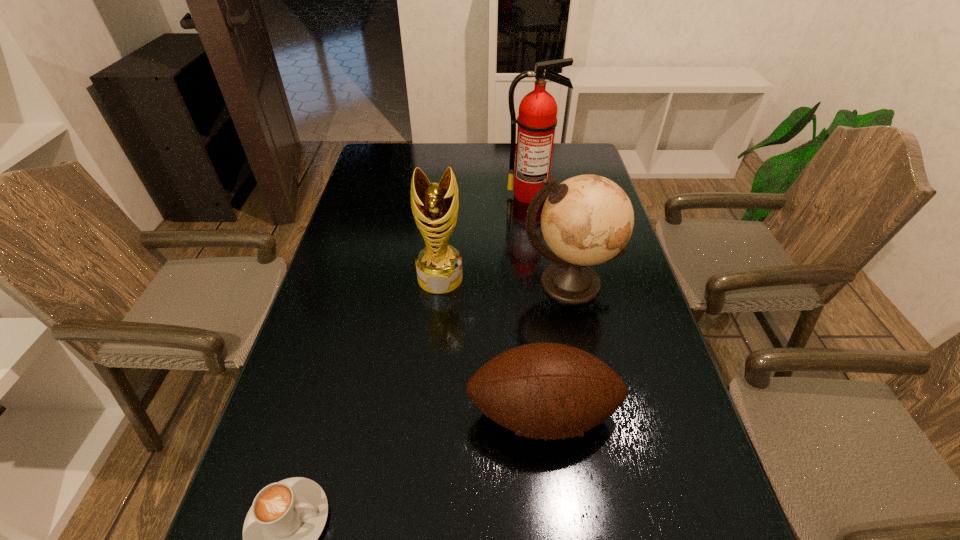
Where is `the farthest object`? The image size is (960, 540). the farthest object is located at coordinates (537, 119).

What are the coordinates of `fire extinguisher` in the screenshot? It's located at (537, 119).

Identify the location of award. This screenshot has width=960, height=540. 435,206.

The width and height of the screenshot is (960, 540). In order to click on globe in this screenshot , I will do `click(587, 220)`.

Identify the location of the second nearest object. (545, 391).

This screenshot has height=540, width=960. Identify the location of football. (545, 391).

Where is `free space located on the side of the fire extinguisher near the handle`? The width and height of the screenshot is (960, 540). free space located on the side of the fire extinguisher near the handle is located at coordinates (541, 264).

This screenshot has height=540, width=960. I want to click on vacant space located 0.400m on the front-facing side of the fourth object from right to left, so click(425, 439).

The width and height of the screenshot is (960, 540). I want to click on free space located on the front-facing side of the globe, so click(x=580, y=338).

At what (x,y) coordinates should I click in order to perform the action: click on free region located 0.050m on the laces of the football. Please return your answer as a coordinate pair (x, y). Looking at the image, I should click on (550, 483).